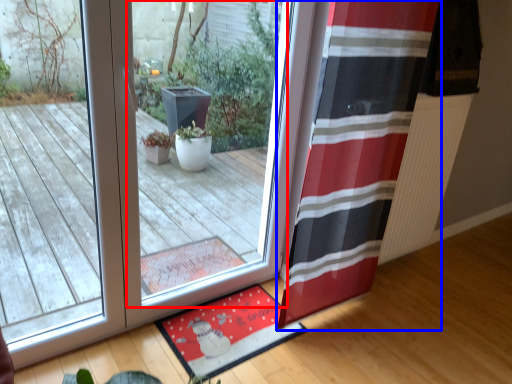
Question: Which point is further to the camera, window (highlighted by a red box) or curtain (highlighted by a blue box)?

Choices:
 (A) window
 (B) curtain

Answer: (B)